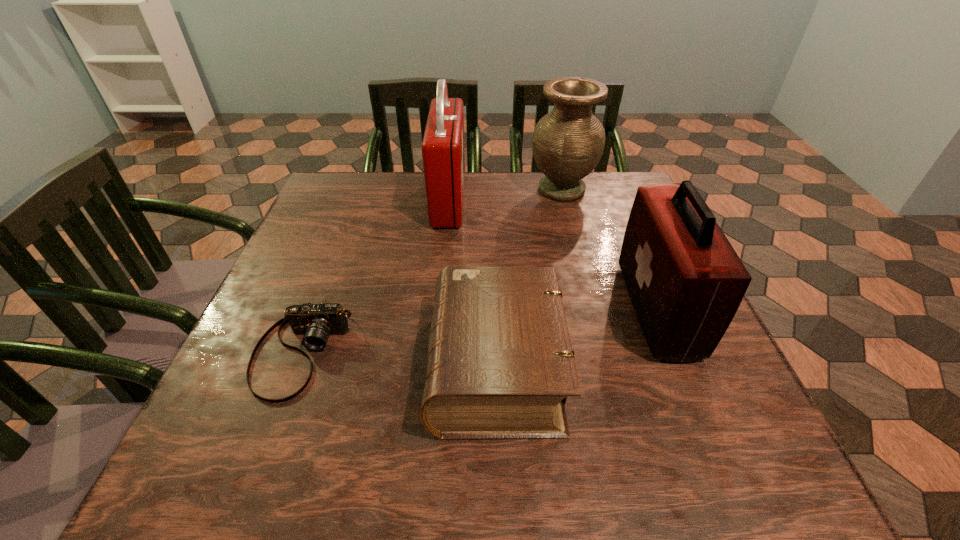
You are a GUI agent. You are given a task and a screenshot of the screen. Output one action in this format:
    pyautogui.click(x=<x>, y=<y>)
    Task: Click on the free space located 0.050m on the side of the right first aid kit with the cross symbol
    The image size is (960, 540).
    Given the screenshot: What is the action you would take?
    pyautogui.click(x=604, y=309)

Find the location of a particular element. This screenshot has width=960, height=540. vacant space located 0.250m on the side of the right first aid kit with the cross symbol is located at coordinates (502, 309).

The image size is (960, 540). Find the location of `vacant space positioned 0.150m on the side of the right first aid kit with the cross symbol`. vacant space positioned 0.150m on the side of the right first aid kit with the cross symbol is located at coordinates (553, 309).

This screenshot has height=540, width=960. In order to click on vacant point located on the spine side of the fourth tallest object in this screenshot , I will do `click(362, 366)`.

What are the coordinates of `free spot located 0.230m on the spine side of the fourth tallest object` in the screenshot? It's located at (299, 366).

This screenshot has width=960, height=540. I want to click on blank space located 0.130m on the spine side of the fourth tallest object, so click(356, 366).

At what (x,y) coordinates should I click in order to perform the action: click on vacant region located 0.050m on the front-facing side of the camera. Please return your answer as a coordinate pair (x, y). The image size is (960, 540). Looking at the image, I should click on (272, 431).

The width and height of the screenshot is (960, 540). What are the coordinates of `the first-aid kit that is at the far edge` in the screenshot? It's located at (443, 155).

This screenshot has width=960, height=540. In order to click on vase present at the far edge in this screenshot , I will do `click(568, 142)`.

This screenshot has height=540, width=960. I want to click on object that is at the near edge, so click(500, 365).